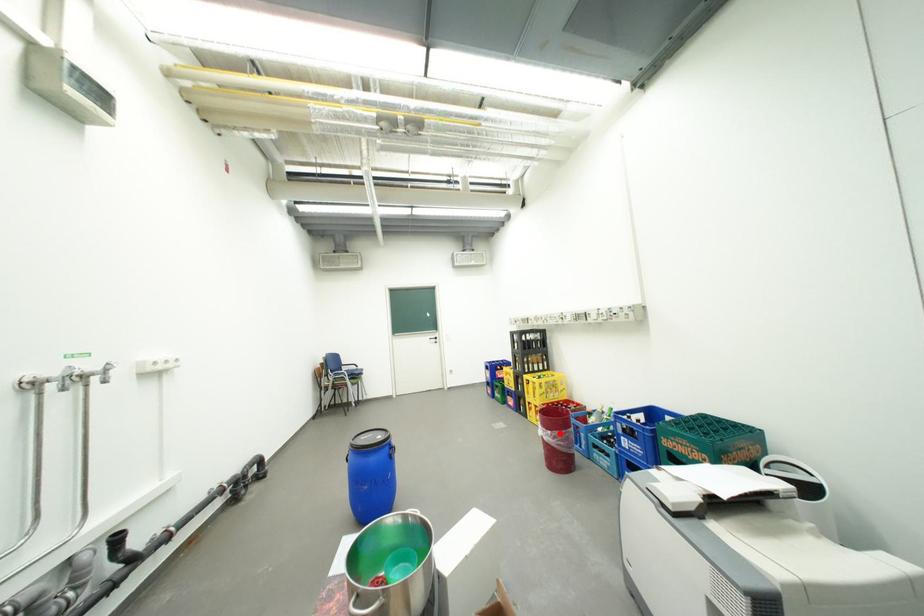
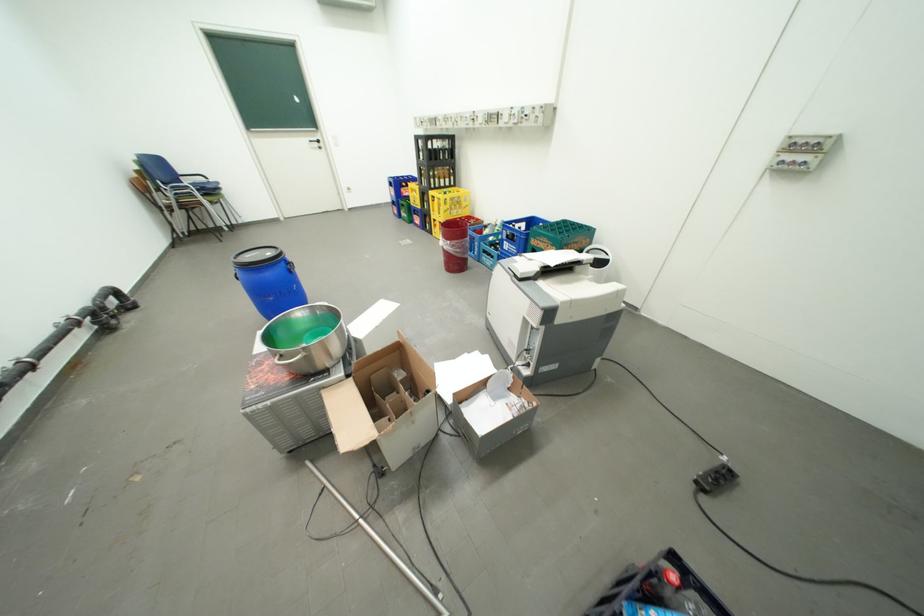
Find the pixel in the second image that matches the highlighted location in the first image.

(459, 243)